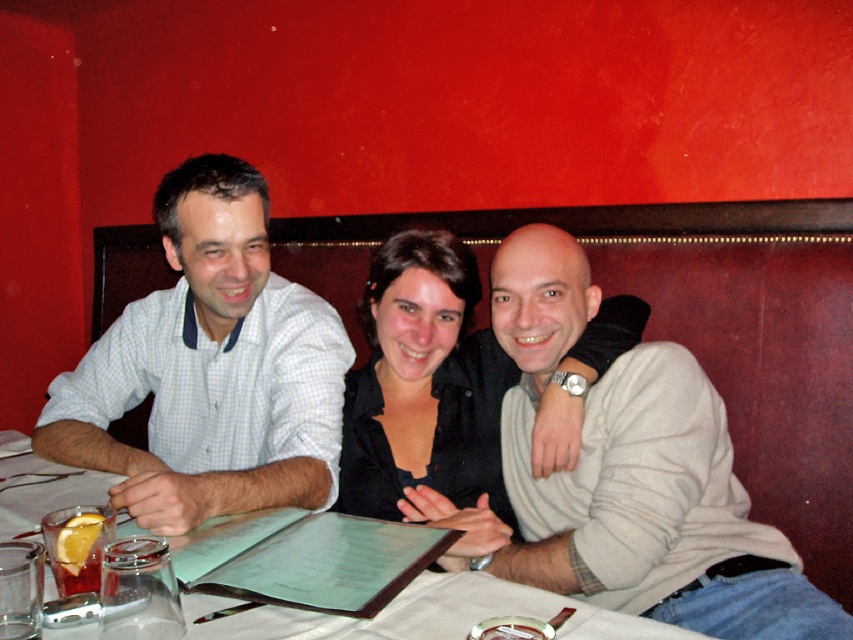
Is black matte shirt at center to the right of white paper menu at center from the viewer's perspective?

Yes, black matte shirt at center is to the right of white paper menu at center.

Does black matte shirt at center have a larger size compared to white paper menu at center?

Yes.

Image resolution: width=853 pixels, height=640 pixels. What are the coordinates of `black matte shirt at center` in the screenshot? It's located at (424, 385).

Where is `black matte shirt at center`? Image resolution: width=853 pixels, height=640 pixels. black matte shirt at center is located at coordinates (424, 385).

Which is in front, point (541, 298) or point (270, 362)?

Point (541, 298) is more forward.

Which is more to the right, light gray sweater at center or white checkered shirt at left?

Positioned to the right is light gray sweater at center.

Is point (727, 595) farther from camera compared to point (155, 385)?

No, it is not.

The width and height of the screenshot is (853, 640). In order to click on light gray sweater at center in this screenshot , I will do `click(627, 476)`.

Looking at this image, is light gray sweater at center positioned at the back of black matte shirt at center?

No, light gray sweater at center is closer to the viewer.

Identify the location of light gray sweater at center. This screenshot has height=640, width=853. (627, 476).

Find the location of a particular element. light gray sweater at center is located at coordinates (627, 476).